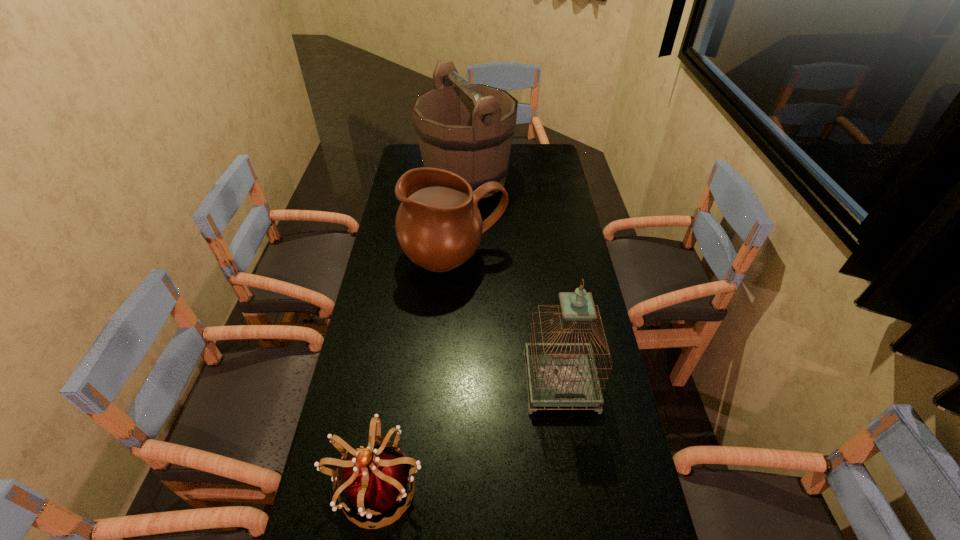
The image size is (960, 540). Find the location of `bucket that is at the left edge`. bucket that is at the left edge is located at coordinates (467, 129).

At what (x,y) coordinates should I click in order to perform the action: click on cream pitcher that is at the left edge. Please return your answer as a coordinate pair (x, y). Image resolution: width=960 pixels, height=540 pixels. Looking at the image, I should click on (438, 224).

You are a GUI agent. You are given a task and a screenshot of the screen. Output one action in this format:
    pyautogui.click(x=<x>, y=<y>)
    Task: Click on the tiara positioned at the left edge
    
    Given the screenshot: What is the action you would take?
    click(375, 482)

Where is `object positioned at the right edge`? The image size is (960, 540). object positioned at the right edge is located at coordinates (560, 374).

At what (x,y) coordinates should I click in order to perform the action: click on object that is positioned at the far left corner. Please return your answer as a coordinate pair (x, y). The height and width of the screenshot is (540, 960). Looking at the image, I should click on (467, 129).

The image size is (960, 540). I want to click on vacant region at the left edge of the desktop, so click(x=407, y=352).

Where is `vacant space at the right edge`? vacant space at the right edge is located at coordinates (614, 517).

You are a GUI agent. You are given a task and a screenshot of the screen. Output one action in this format:
    pyautogui.click(x=<x>, y=<y>)
    Task: Click on the free space at the far right corner of the desktop
    
    Given the screenshot: What is the action you would take?
    pyautogui.click(x=537, y=167)

Identify the location of free point between the third tallest object and the shortest object. This screenshot has height=540, width=960. (416, 371).

Find the location of a particular element. vacant area that lies between the bucket and the birdcage is located at coordinates (514, 280).